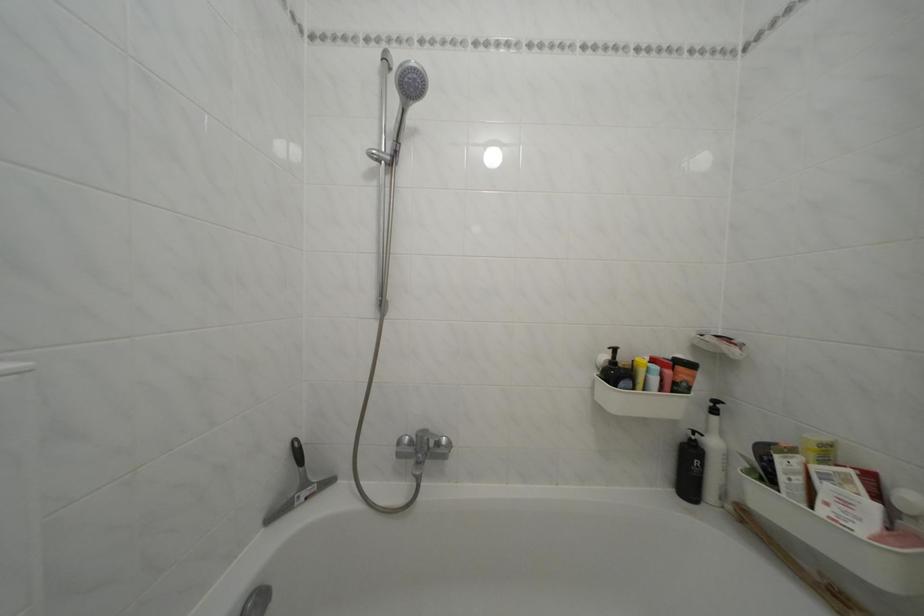
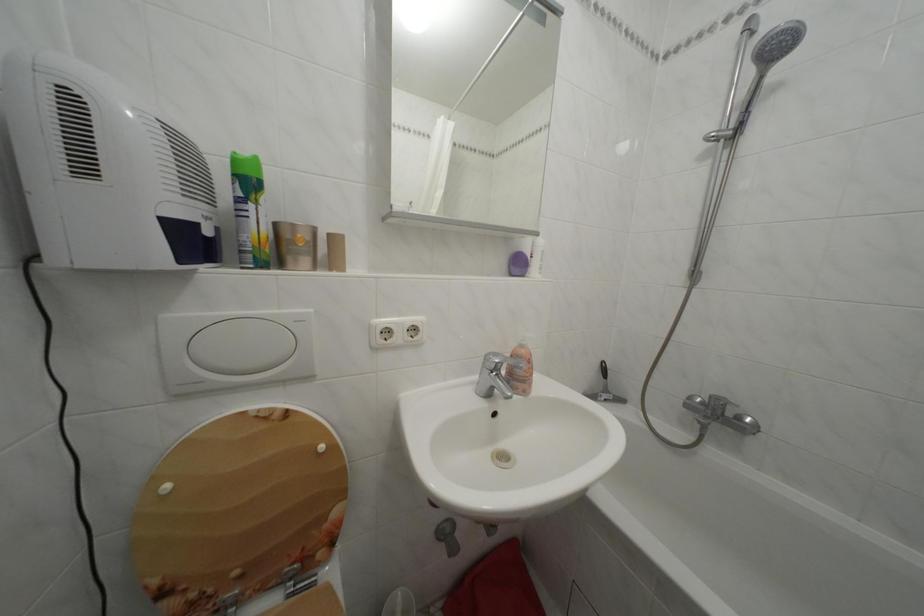
Question: How did the camera likely rotate?

Choices:
 (A) Left
 (B) Right
 (C) Up
 (D) Down

Answer: (A)